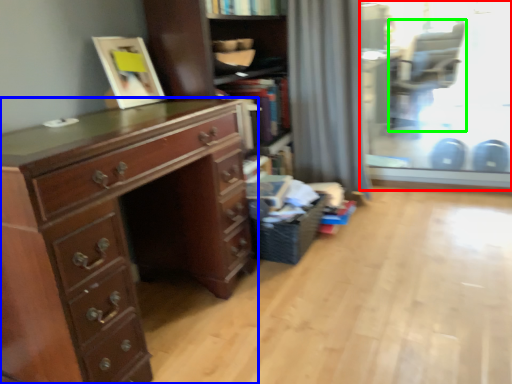
Question: Which object is positioned closest to glass door (highlighted by a red box)? Select from chest of drawers (highlighted by a blue box) and armchair (highlighted by a green box).

Choices:
 (A) chest of drawers
 (B) armchair

Answer: (B)